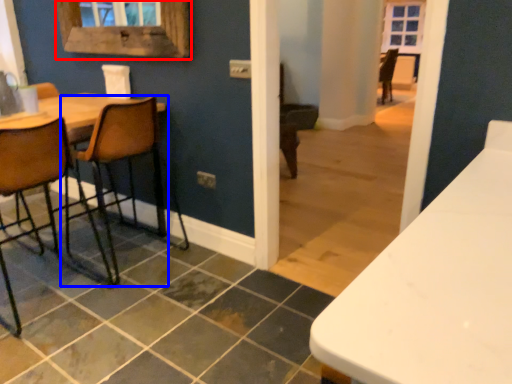
Question: Which of the following is the farthest to the observer, window frame (highlighted by a red box) or chair (highlighted by a blue box)?

Choices:
 (A) window frame
 (B) chair

Answer: (A)